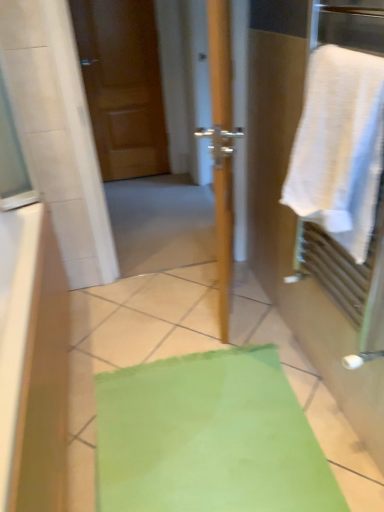
Question: From a real-world perspective, relative to white cotton towel at right, is matte wood door at upper left vertically above or below?

Choices:
 (A) below
 (B) above

Answer: (A)

Question: Based on their positions, is matte wood door at upper left located to the left or right of white cotton towel at right?

Choices:
 (A) left
 (B) right

Answer: (A)

Question: Which object is the farthest from the wooden door at center?

Choices:
 (A) white cotton towel at right
 (B) matte wood door at upper left

Answer: (A)

Question: Based on their relative distances, which object is nearer to the wooden door at center?

Choices:
 (A) white cotton towel at right
 (B) matte wood door at upper left

Answer: (B)